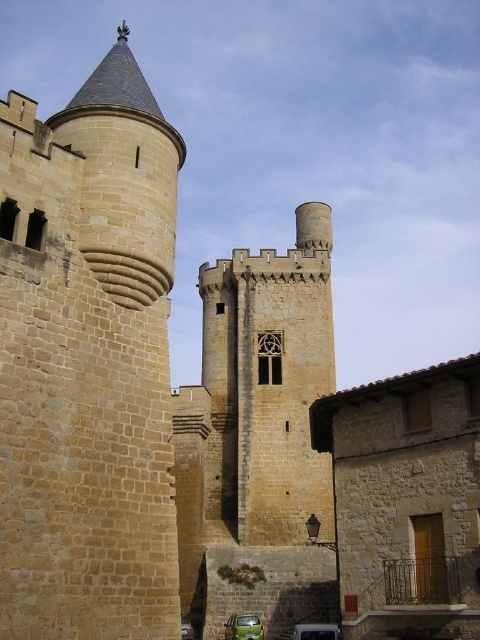
Question: Does brown stone tower at left appear on the right side of brown stone tower at center?

Choices:
 (A) yes
 (B) no

Answer: (B)

Question: Which object appears farthest from the camera in this image?

Choices:
 (A) brown stone tower at center
 (B) brown stone tower at left

Answer: (A)

Question: Is brown stone tower at left further to camera compared to brown stone tower at center?

Choices:
 (A) no
 (B) yes

Answer: (A)

Question: Is brown stone tower at left closer to camera compared to brown stone tower at center?

Choices:
 (A) no
 (B) yes

Answer: (B)